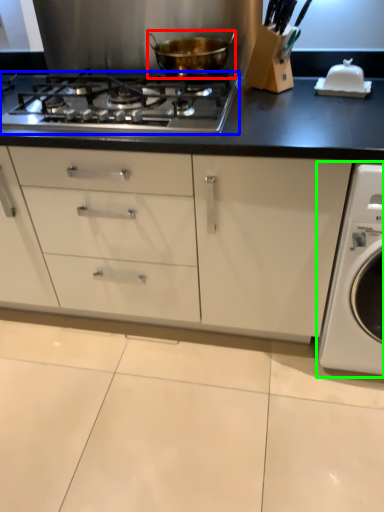
Question: Estimate the real-world distances between objects in this image. Which object is closer to kitchen appliance (highlighted by a red box), gas stove (highlighted by a blue box) or washing machine (highlighted by a green box)?

Choices:
 (A) gas stove
 (B) washing machine

Answer: (A)